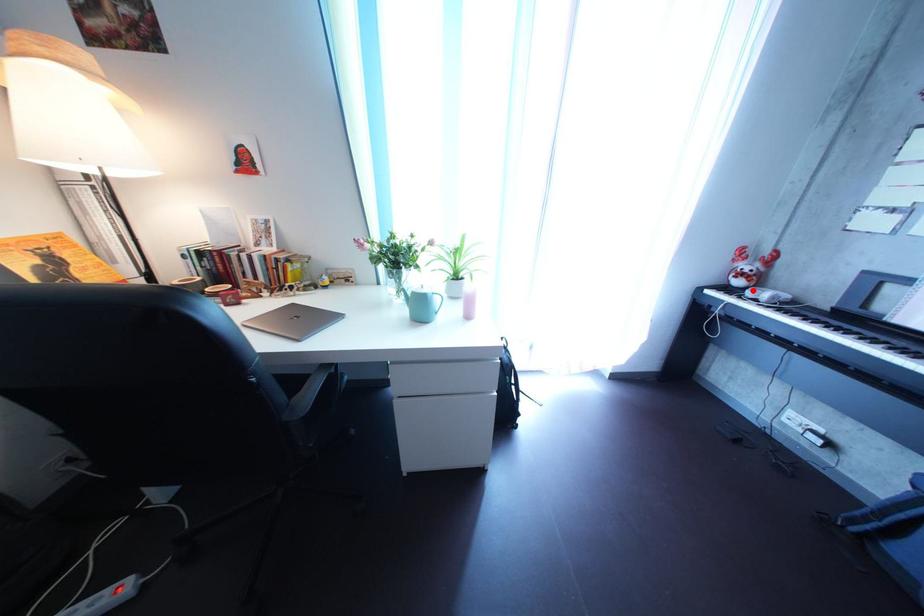
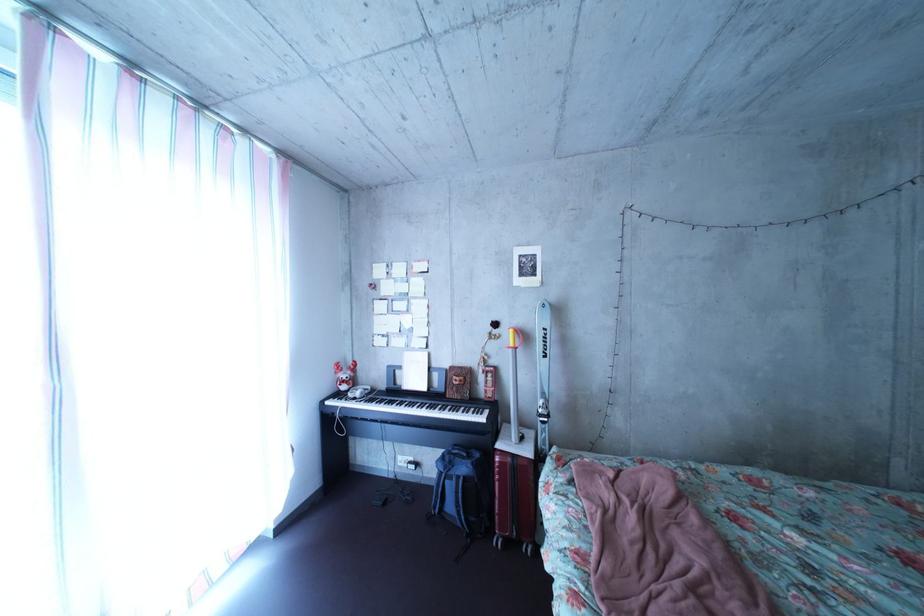
Find the pixel in the second image that matches the highlighted location in the first image.

(358, 395)